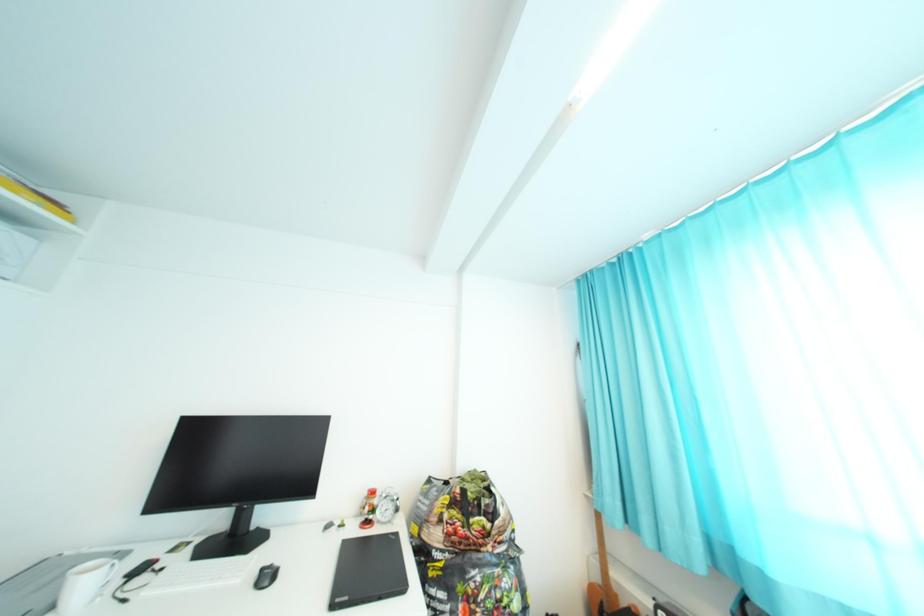
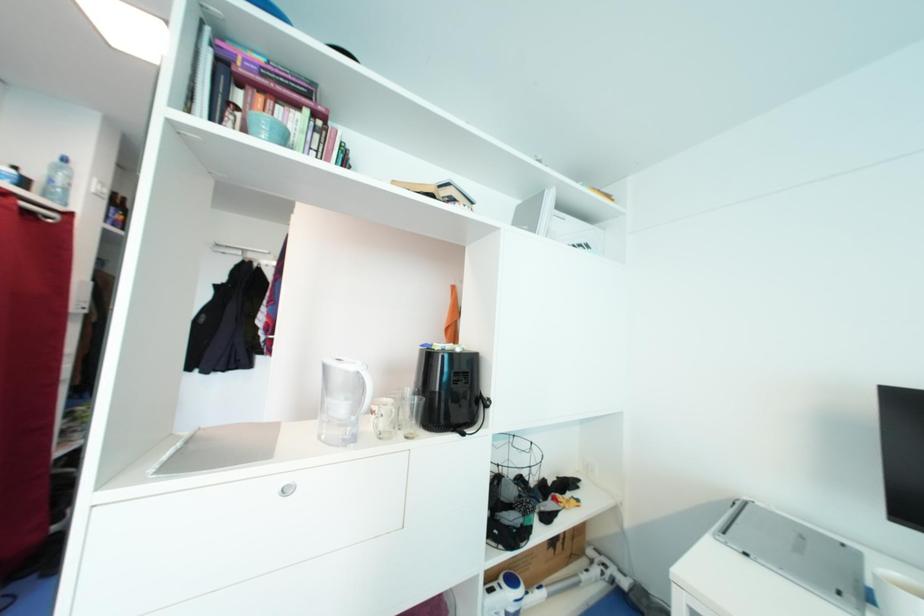
Question: Based on the continuous images, in which direction is the camera rotating? Reply with the corresponding letter.

Choices:
 (A) Left
 (B) Right
 (C) Up
 (D) Down

Answer: (A)